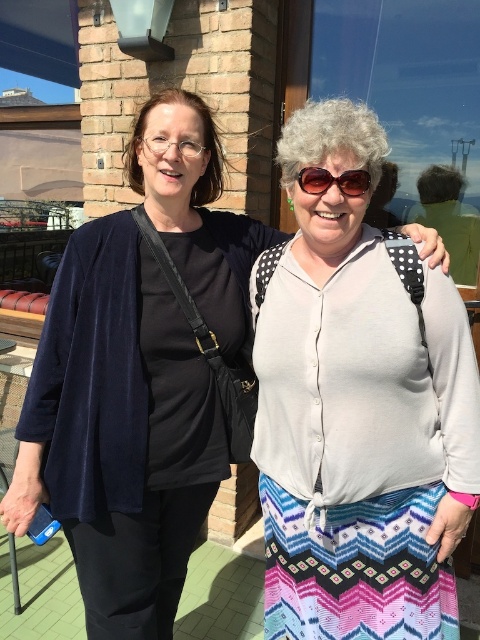
You are a fashion designer observing the two items in the image. Which item has a greater width between the white textured blouse at center and the brown plastic sunglasses at center?

The white textured blouse at center has a greater width than the brown plastic sunglasses at center.

You are trying to decide which item to pack first in your bag. You see the white textured blouse at center and the brown plastic sunglasses at center. Which item takes up more space?

The white textured blouse at center is bigger than the brown plastic sunglasses at center, so it takes up more space.